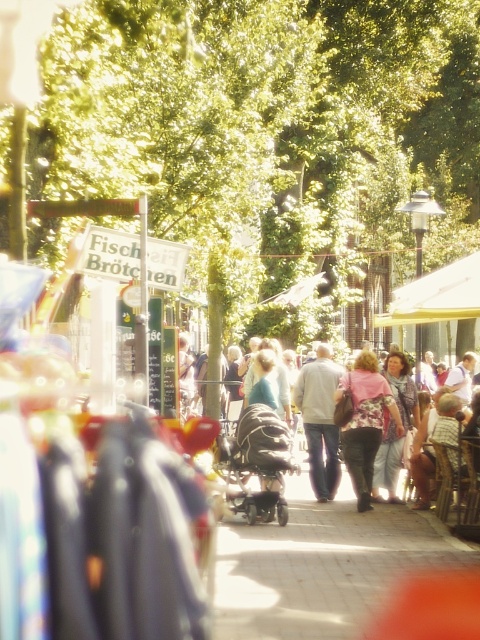
You are a vendor at the market and need to arrange the blue denim jeans at center and the light blue fabric dress at center closer together to save space. How much closer should you move them to reduce the space between them by half?

To reduce the space between the blue denim jeans at center and the light blue fabric dress at center by half, you should move them closer so that the distance between them becomes 0.54 meters.